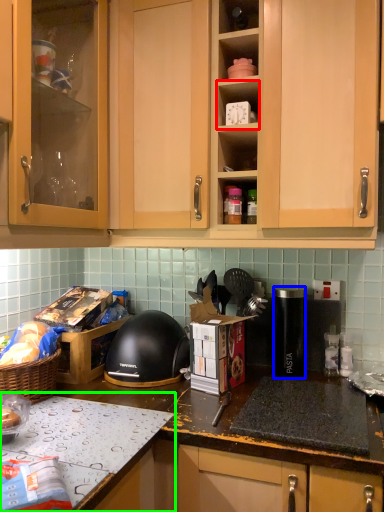
Question: Estimate the real-world distances between objects in this image. Which object is farther from shelf (highlighted by a red box), kitchen appliance (highlighted by a blue box) or countertop (highlighted by a green box)?

Choices:
 (A) kitchen appliance
 (B) countertop

Answer: (B)